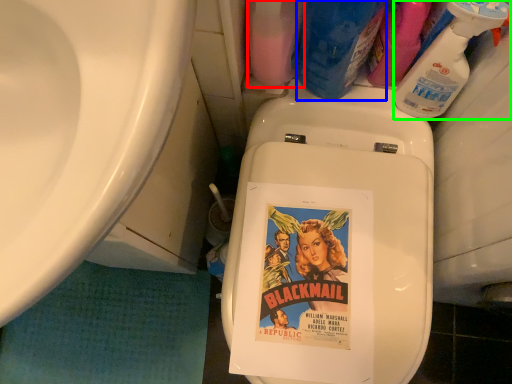
Question: Considering the real-world distances, which object is closest to cleaning product (highlighted by a red box)? cleaning product (highlighted by a blue box) or cleaning product (highlighted by a green box).

Choices:
 (A) cleaning product
 (B) cleaning product

Answer: (A)